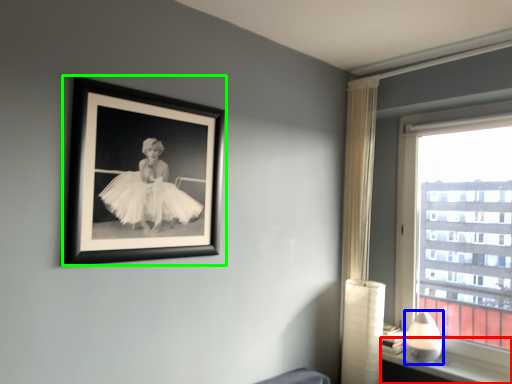
Question: Considering the real-world distances, which object is farthest from window sill (highlighted by a red box)? table lamp (highlighted by a blue box) or picture frame (highlighted by a green box)?

Choices:
 (A) table lamp
 (B) picture frame

Answer: (B)